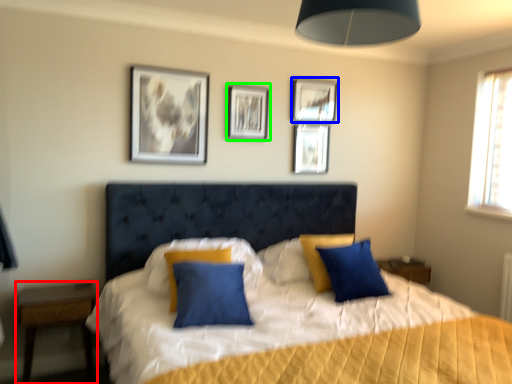
Question: Which object is positioned farthest from nightstand (highlighted by a red box)? Select from picture frame (highlighted by a blue box) and picture frame (highlighted by a green box).

Choices:
 (A) picture frame
 (B) picture frame

Answer: (A)